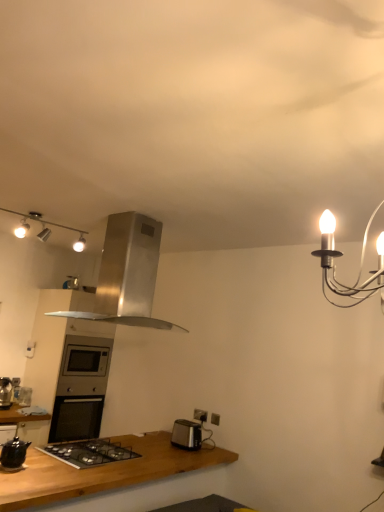
Question: In terms of size, does brushed metal toaster at lower left appear bigger or smaller than black matte gas stove at lower left?

Choices:
 (A) small
 (B) big

Answer: (A)

Question: From the image's perspective, is brushed metal toaster at lower left positioned above or below black matte gas stove at lower left?

Choices:
 (A) below
 (B) above

Answer: (A)

Question: Estimate the real-world distances between objects in this image. Which object is farther from the satin silver oven at center?

Choices:
 (A) white plastic electric outlet at lower center, which is counted as the second electric outlet, starting from the right
 (B) satin silver toaster at lower center
 (C) matte silver track lights at upper left
 (D) brushed metal toaster at lower left
 (E) matte black kettle at lower left

Answer: (E)

Question: Based on their relative distances, which object is nearer to the brown wooden countertop at lower left?

Choices:
 (A) matte black kettle at lower left
 (B) black matte gas stove at lower left
 (C) brushed metal toaster at lower left
 (D) white plastic electric outlet at lower center, the second electric outlet positioned from the front
 (E) matte gray electric outlet at lower center, acting as the 1th electric outlet starting from the right

Answer: (B)